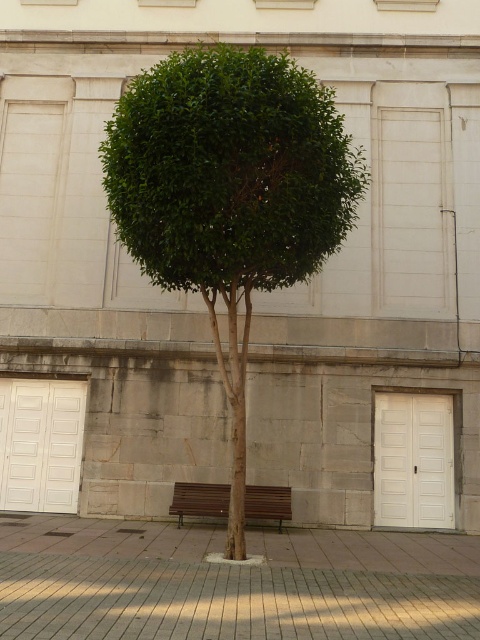
Can you confirm if green leafy tree at center is wider than white glossy door at left?

Indeed, green leafy tree at center has a greater width compared to white glossy door at left.

Is point (201, 60) positioned in front of point (20, 452)?

Yes, it is in front of point (20, 452).

You are a GUI agent. You are given a task and a screenshot of the screen. Output one action in this format:
    pyautogui.click(x=<x>, y=<y>)
    Task: Click on the green leafy tree at center
    The height and width of the screenshot is (640, 480).
    Given the screenshot: What is the action you would take?
    pyautogui.click(x=229, y=193)

Does white glossy door at left appear on the right side of white matte door at lower right?

Incorrect, white glossy door at left is not on the right side of white matte door at lower right.

Does point (49, 497) come behind point (376, 509)?

That is True.

Locate an element on the screen. white glossy door at left is located at coordinates (40, 444).

Can you confirm if white matte door at lower right is smaller than brown wooden bench at center?

Incorrect, white matte door at lower right is not smaller in size than brown wooden bench at center.

Is white matte door at lower right to the right of brown wooden bench at center from the viewer's perspective?

Yes, white matte door at lower right is to the right of brown wooden bench at center.

Who is more forward, (416, 506) or (179, 486)?

Point (179, 486) is in front.

Where is `white matte door at lower right`? This screenshot has width=480, height=640. white matte door at lower right is located at coordinates (414, 460).